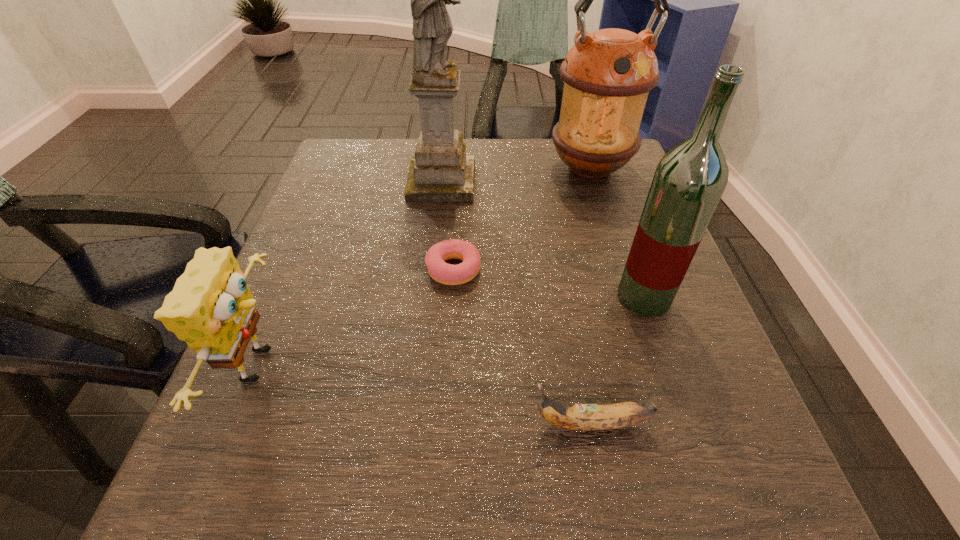
This screenshot has width=960, height=540. Identify the location of free region that satisfies the following two spatial constraints: 1. on the back side of the shortest object; 2. on the left side of the oil lamp. (459, 168).